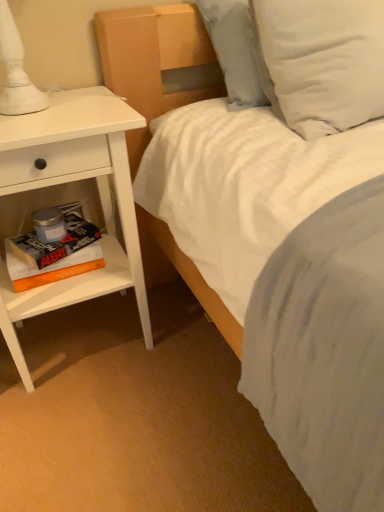
Question: Should I look upward or downward to see white soft pillow at upper right, arranged as the 1th pillow when viewed from the right?

Choices:
 (A) up
 (B) down

Answer: (A)

Question: Is white soft pillow at upper right, arranged as the 1th pillow when viewed from the right, taller than white textured pillow at upper right, which is the 2th pillow in right-to-left order?

Choices:
 (A) yes
 (B) no

Answer: (A)

Question: From the image's perspective, would you say white soft pillow at upper right, acting as the second pillow starting from the left, is positioned over white textured pillow at upper right, which is counted as the first pillow, starting from the left?

Choices:
 (A) no
 (B) yes

Answer: (A)

Question: Is white soft pillow at upper right, acting as the second pillow starting from the left, directly adjacent to white textured pillow at upper right, which is the 2th pillow in right-to-left order?

Choices:
 (A) no
 (B) yes

Answer: (A)

Question: Is white soft pillow at upper right, acting as the second pillow starting from the left, aimed at white textured pillow at upper right, which is counted as the first pillow, starting from the left?

Choices:
 (A) no
 (B) yes

Answer: (A)

Question: Does white soft pillow at upper right, arranged as the 1th pillow when viewed from the right, come behind white textured pillow at upper right, which is the 2th pillow in right-to-left order?

Choices:
 (A) yes
 (B) no

Answer: (B)

Question: Can you confirm if white soft pillow at upper right, arranged as the 1th pillow when viewed from the right, is shorter than white textured pillow at upper right, which is counted as the first pillow, starting from the left?

Choices:
 (A) yes
 (B) no

Answer: (B)

Question: Is hardcover book at left, which is the 1th paperback book in top-to-bottom order, wider than white matte nightstand at left?

Choices:
 (A) no
 (B) yes

Answer: (A)

Question: Is hardcover book at left, which is the 1th paperback book in top-to-bottom order, directly adjacent to white matte nightstand at left?

Choices:
 (A) yes
 (B) no

Answer: (B)

Question: Considering the relative sizes of hardcover book at left, which is the 1th paperback book in top-to-bottom order, and white matte nightstand at left in the image provided, is hardcover book at left, which is the 1th paperback book in top-to-bottom order, bigger than white matte nightstand at left?

Choices:
 (A) no
 (B) yes

Answer: (A)

Question: Can you confirm if hardcover book at left, which is counted as the second paperback book, starting from the bottom, is smaller than white matte nightstand at left?

Choices:
 (A) no
 (B) yes

Answer: (B)

Question: Considering the relative sizes of hardcover book at left, which is the 1th paperback book in top-to-bottom order, and white matte nightstand at left in the image provided, is hardcover book at left, which is the 1th paperback book in top-to-bottom order, taller than white matte nightstand at left?

Choices:
 (A) yes
 (B) no

Answer: (B)

Question: From a real-world perspective, does hardcover book at left, which is counted as the second paperback book, starting from the bottom, stand above white matte nightstand at left?

Choices:
 (A) no
 (B) yes

Answer: (A)

Question: Is white textured pillow at upper right, which is the 2th pillow in right-to-left order, smaller than hardcover book at left, which is the 1th paperback book in top-to-bottom order?

Choices:
 (A) yes
 (B) no

Answer: (B)